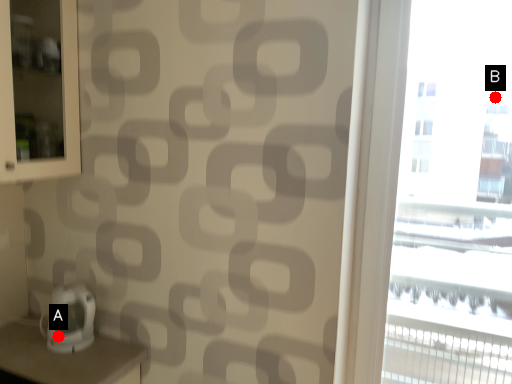
Question: Two points are circled on the image, labeled by A and B beside each circle. Among these points, which one is farthest from the camera?

Choices:
 (A) A is further
 (B) B is further

Answer: (A)